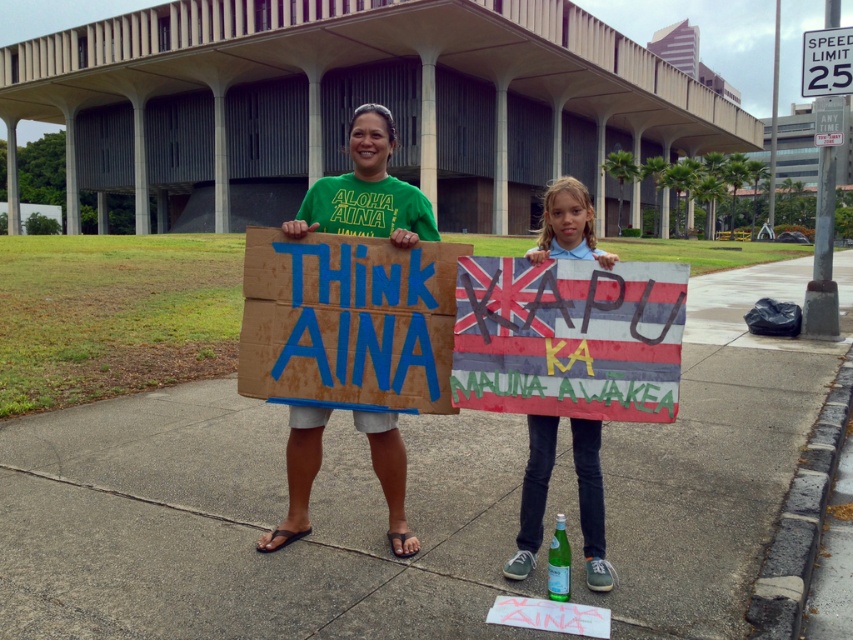
Is white cotton shirt at center thinner than white plastic speed limit sign at upper right?

Yes, white cotton shirt at center is thinner than white plastic speed limit sign at upper right.

Who is positioned more to the right, white cotton shirt at center or white plastic speed limit sign at upper right?

white plastic speed limit sign at upper right is more to the right.

Is point (517, 552) positioned after point (846, 68)?

No, it is in front of (846, 68).

Locate an element on the screen. The width and height of the screenshot is (853, 640). white cotton shirt at center is located at coordinates (567, 225).

Measure the distance from brown concrete pavement at center to cardboard sign at center.

1.84 meters

Does point (167, 604) come behind point (252, 232)?

No, (167, 604) is closer to viewer.

Which is in front, point (444, 480) or point (428, 292)?

Point (428, 292)

What are the coordinates of `brown concrete pavement at center` in the screenshot? It's located at (247, 524).

Is point (724, 301) in front of point (631, 296)?

No, it is behind (631, 296).

Measure the distance from brown concrete pavement at center to hand-painted fabric sign at center.

The distance of brown concrete pavement at center from hand-painted fabric sign at center is 1.23 meters.

Does point (96, 428) come farther from viewer compared to point (485, 348)?

Yes, point (96, 428) is behind point (485, 348).

Find the location of `brown concrete pavement at center`. brown concrete pavement at center is located at coordinates [x=247, y=524].